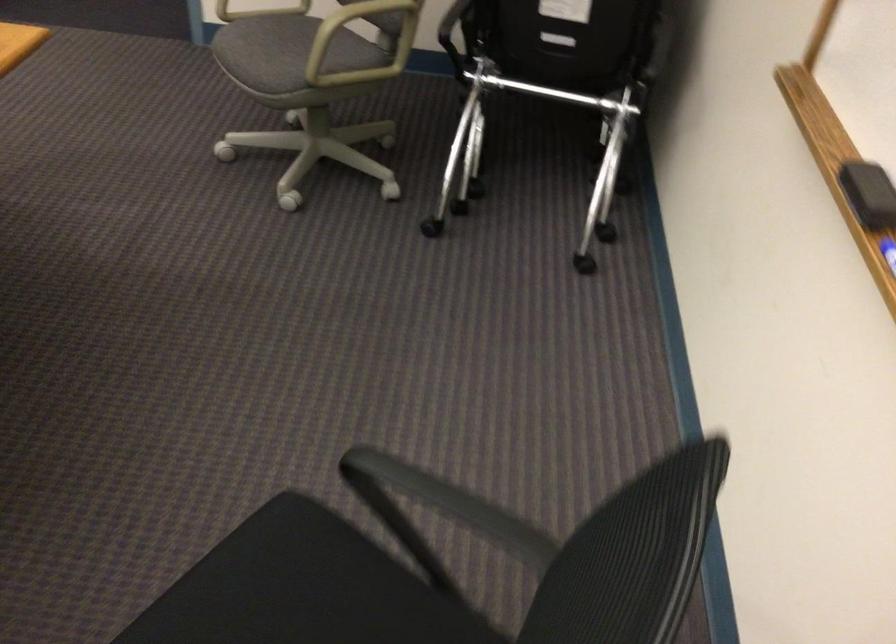
The height and width of the screenshot is (644, 896). Describe the element at coordinates (297, 590) in the screenshot. I see `the black chair sitting surface` at that location.